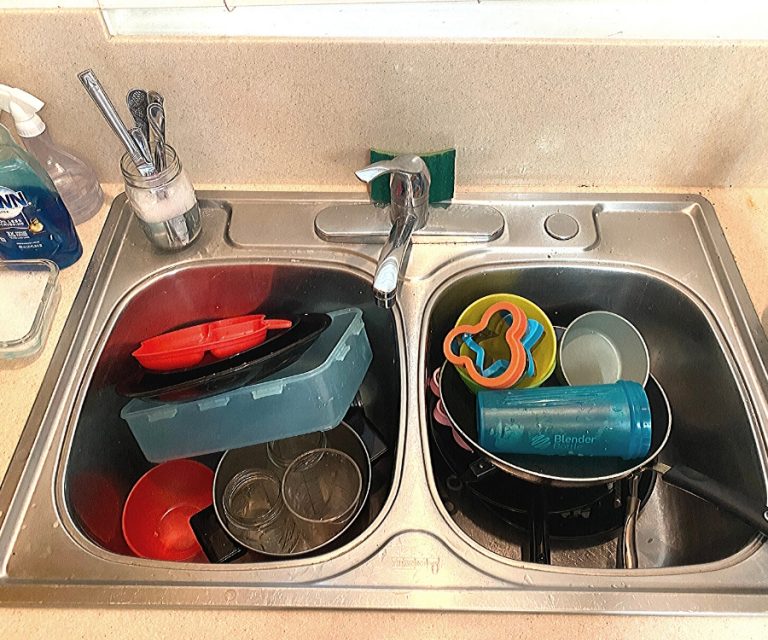
Identify the location of utensils in a mason jar filled with soapy water. (144, 145), (151, 186), (166, 212).